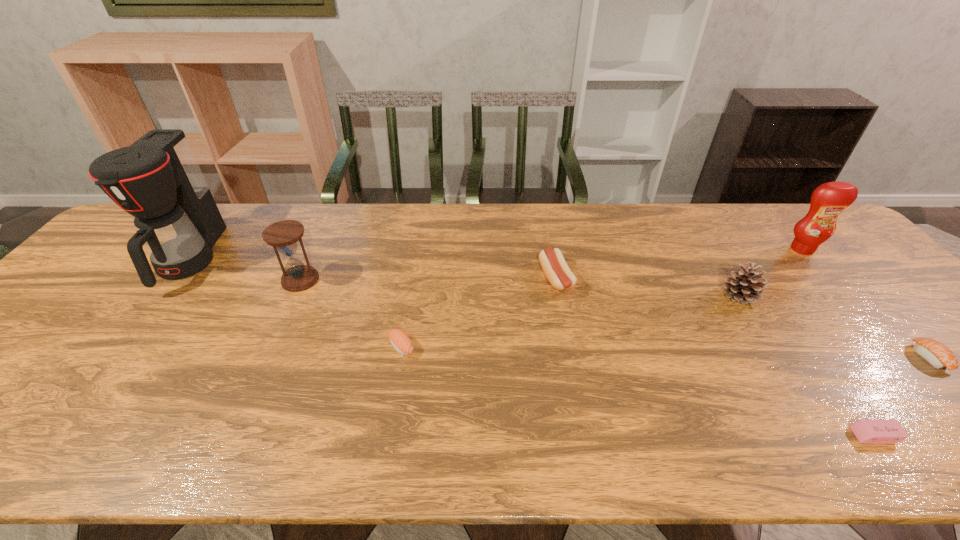
Where is `vacant space at the near edge of the desktop`? This screenshot has width=960, height=540. vacant space at the near edge of the desktop is located at coordinates (618, 422).

Find the location of `vacant point at the left edge`. vacant point at the left edge is located at coordinates (111, 292).

I want to click on free space at the right edge of the desktop, so click(848, 280).

The image size is (960, 540). In the image, there is a desktop. What are the coordinates of `vacant space at the far right corner` in the screenshot? It's located at (833, 237).

In order to click on vacant point located between the seventh shortest object and the eraser in this screenshot , I will do `click(838, 342)`.

This screenshot has height=540, width=960. Find the location of `vacant region between the fifth object from right to left and the nearest object`. vacant region between the fifth object from right to left and the nearest object is located at coordinates (715, 356).

Locate an element on the screen. The height and width of the screenshot is (540, 960). vacant area that lies between the third shortest object and the pinecone is located at coordinates (570, 321).

You are a GUI agent. You are given a task and a screenshot of the screen. Output one action in this format:
    pyautogui.click(x=<x>, y=<y>)
    Task: Click on the free space between the second shortest object and the eraser
    The image size is (960, 540).
    Given the screenshot: What is the action you would take?
    pyautogui.click(x=901, y=396)

Identify the location of vacant area between the fourth shortest object and the seventh tallest object. This screenshot has height=540, width=960. (742, 318).

Locate an element on the screen. free area in between the fourth object from right to left and the condiment is located at coordinates (771, 273).